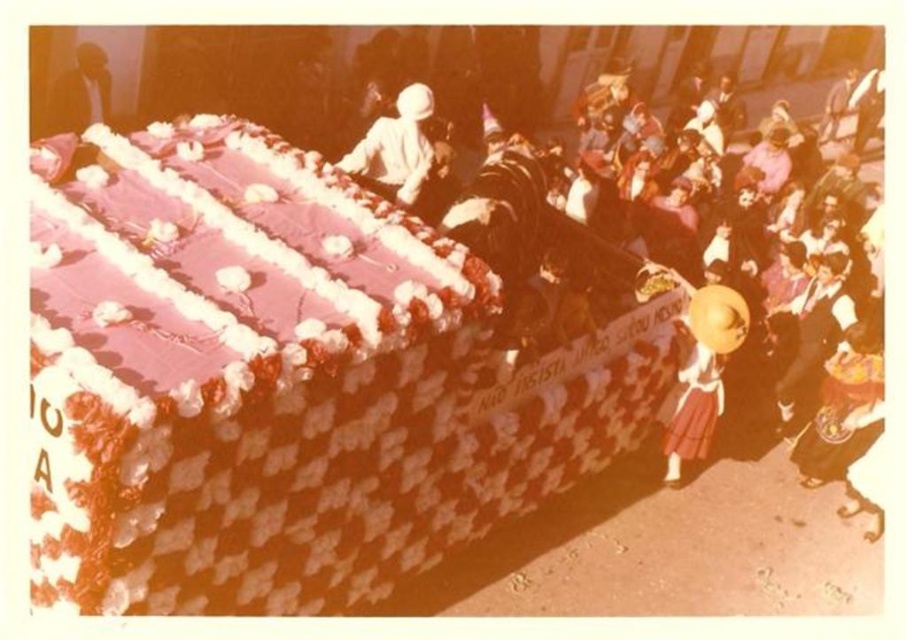
Question: Which object is the closest to the yellow straw hat at center?

Choices:
 (A) white clothed figure at center
 (B) dark brown leather jacket at upper left

Answer: (A)

Question: Is white clothed figure at center below dark brown leather jacket at upper left?

Choices:
 (A) no
 (B) yes

Answer: (B)

Question: Which point is farther to the camera?

Choices:
 (A) yellow straw hat at center
 (B) dark brown leather jacket at upper left

Answer: (B)

Question: Can you confirm if white clothed figure at center is bigger than dark brown leather jacket at upper left?

Choices:
 (A) no
 (B) yes

Answer: (B)

Question: Is white clothed figure at center in front of dark brown leather jacket at upper left?

Choices:
 (A) yes
 (B) no

Answer: (A)

Question: Which point is farther to the camera?

Choices:
 (A) dark brown leather jacket at upper left
 (B) white clothed figure at center

Answer: (A)